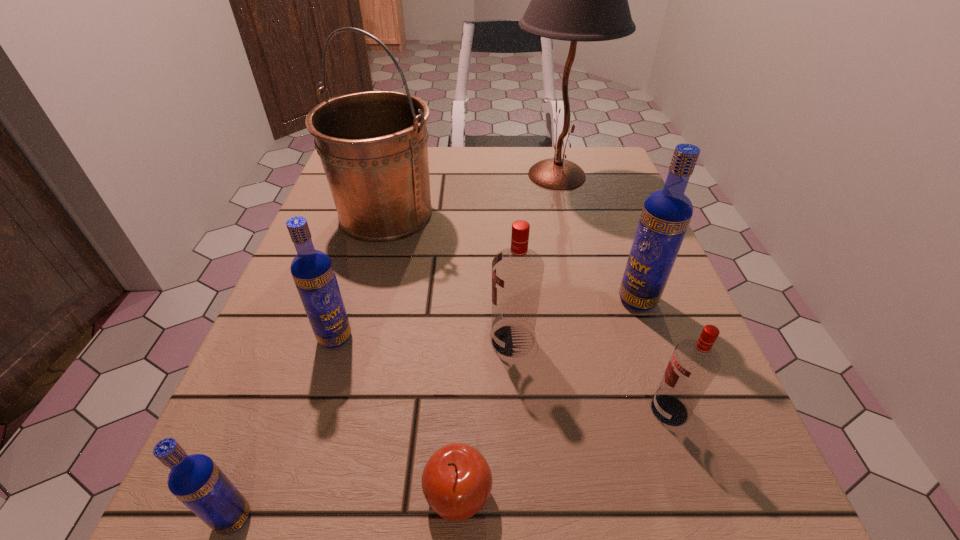
The height and width of the screenshot is (540, 960). Find the location of `the tallest object`. the tallest object is located at coordinates (585, 0).

Locate an element on the screen. The width and height of the screenshot is (960, 540). the seventh shortest object is located at coordinates (373, 146).

The image size is (960, 540). Find the location of `the sixth shortest object`. the sixth shortest object is located at coordinates (666, 214).

This screenshot has height=540, width=960. Identify the location of the biggest blue vodka. (666, 214).

The width and height of the screenshot is (960, 540). I want to click on the second nearest blue vodka, so click(x=312, y=270).

This screenshot has width=960, height=540. Find the location of `the second blue vodka from right to left`. the second blue vodka from right to left is located at coordinates (312, 270).

This screenshot has width=960, height=540. I want to click on the bigger red vodka, so click(517, 272).

This screenshot has width=960, height=540. Identify the location of the left red vodka. (517, 272).

Locate an element on the screen. Image resolution: width=960 pixels, height=540 pixels. the nearer red vodka is located at coordinates (694, 363).

Where is `the right red vodka`? the right red vodka is located at coordinates (694, 363).